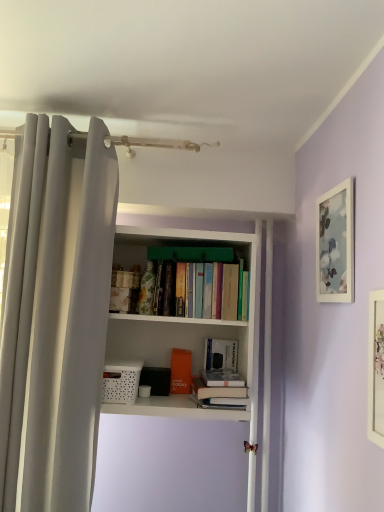
Question: Considering the relative sizes of white matte picture frame at upper right, the second picture frame positioned from the front, and hardcover books at center, positioned as the first book in top-to-bottom order, in the image provided, is white matte picture frame at upper right, the second picture frame positioned from the front, smaller than hardcover books at center, positioned as the first book in top-to-bottom order,?

Choices:
 (A) no
 (B) yes

Answer: (B)

Question: Is white matte picture frame at upper right, acting as the first picture frame starting from the back, facing towards hardcover books at center, positioned as the first book in top-to-bottom order?

Choices:
 (A) no
 (B) yes

Answer: (A)

Question: Is white matte picture frame at upper right, the second picture frame positioned from the front, positioned beyond the bounds of hardcover books at center, positioned as the first book in top-to-bottom order?

Choices:
 (A) yes
 (B) no

Answer: (A)

Question: From a real-world perspective, is white matte picture frame at upper right, acting as the first picture frame starting from the back, positioned over hardcover books at center, which is the fourth book from bottom to top, based on gravity?

Choices:
 (A) yes
 (B) no

Answer: (A)

Question: Is white matte picture frame at upper right, acting as the first picture frame starting from the back, oriented away from hardcover books at center, positioned as the first book in top-to-bottom order?

Choices:
 (A) yes
 (B) no

Answer: (B)

Question: Can you confirm if white matte picture frame at upper right, acting as the first picture frame starting from the back, is wider than hardcover books at center, positioned as the first book in top-to-bottom order?

Choices:
 (A) yes
 (B) no

Answer: (B)

Question: From a real-world perspective, does matte white picture frame at right, the second picture frame in the back-to-front sequence, stand above hardcover book at center, the 1th book from the bottom?

Choices:
 (A) yes
 (B) no

Answer: (A)

Question: From the image's perspective, would you say matte white picture frame at right, the 1th picture frame positioned from the front, is shown under hardcover book at center, marked as the 4th book in a top-to-bottom arrangement?

Choices:
 (A) yes
 (B) no

Answer: (B)

Question: Is matte white picture frame at right, the 1th picture frame positioned from the front, closer to camera compared to hardcover book at center, the 1th book from the bottom?

Choices:
 (A) yes
 (B) no

Answer: (A)

Question: Can you confirm if matte white picture frame at right, the 1th picture frame positioned from the front, is thinner than hardcover book at center, the 1th book from the bottom?

Choices:
 (A) yes
 (B) no

Answer: (A)

Question: Is hardcover book at center, the 1th book from the bottom, located within matte white picture frame at right, the second picture frame in the back-to-front sequence?

Choices:
 (A) yes
 (B) no

Answer: (B)

Question: Is matte white picture frame at right, the 1th picture frame positioned from the front, with hardcover book at center, the 1th book from the bottom?

Choices:
 (A) no
 (B) yes

Answer: (A)

Question: Can you confirm if white matte book at center, acting as the 2th book starting from the top, is smaller than white fabric curtain at left?

Choices:
 (A) no
 (B) yes

Answer: (B)